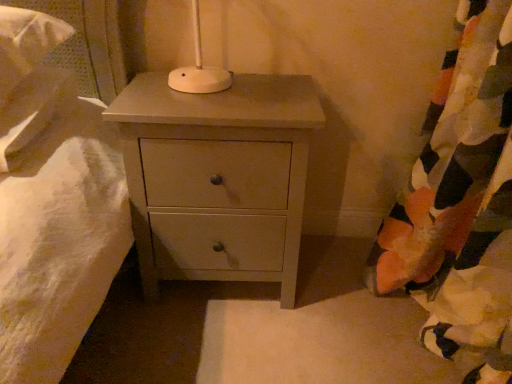
Question: From a real-world perspective, is floral fabric curtain at right physically below matte white chest of drawers at center?

Choices:
 (A) no
 (B) yes

Answer: (A)

Question: From the image's perspective, is floral fabric curtain at right above matte white chest of drawers at center?

Choices:
 (A) no
 (B) yes

Answer: (A)

Question: Would you say floral fabric curtain at right contains matte white chest of drawers at center?

Choices:
 (A) yes
 (B) no

Answer: (B)

Question: Is floral fabric curtain at right oriented towards matte white chest of drawers at center?

Choices:
 (A) yes
 (B) no

Answer: (A)

Question: Is floral fabric curtain at right to the left of matte white chest of drawers at center from the viewer's perspective?

Choices:
 (A) no
 (B) yes

Answer: (A)

Question: Is floral fabric curtain at right further to camera compared to matte white chest of drawers at center?

Choices:
 (A) no
 (B) yes

Answer: (A)

Question: Does matte white chest of drawers at center have a lesser height compared to floral fabric curtain at right?

Choices:
 (A) no
 (B) yes

Answer: (B)

Question: Is matte white chest of drawers at center looking in the opposite direction of floral fabric curtain at right?

Choices:
 (A) no
 (B) yes

Answer: (A)

Question: From a real-world perspective, is matte white chest of drawers at center positioned over floral fabric curtain at right based on gravity?

Choices:
 (A) yes
 (B) no

Answer: (B)

Question: Considering the relative sizes of matte white chest of drawers at center and floral fabric curtain at right in the image provided, is matte white chest of drawers at center bigger than floral fabric curtain at right?

Choices:
 (A) yes
 (B) no

Answer: (B)

Question: Is matte white chest of drawers at center positioned before floral fabric curtain at right?

Choices:
 (A) no
 (B) yes

Answer: (A)

Question: Is matte white chest of drawers at center at the left side of floral fabric curtain at right?

Choices:
 (A) yes
 (B) no

Answer: (A)

Question: Considering their positions, is floral fabric curtain at right located in front of or behind matte white chest of drawers at center?

Choices:
 (A) front
 (B) behind

Answer: (A)